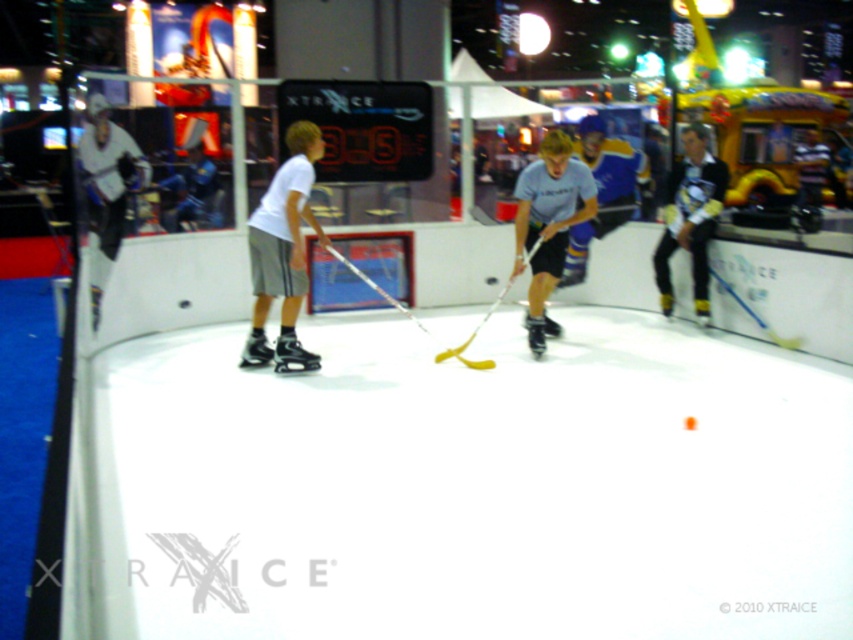
Is white matte shorts at center thinner than yellow plastic hockey stick at center?

Correct, white matte shorts at center's width is less than yellow plastic hockey stick at center's.

Does white matte shorts at center come behind yellow plastic hockey stick at center?

No, it is not.

Locate an element on the screen. Image resolution: width=853 pixels, height=640 pixels. white matte shorts at center is located at coordinates (283, 252).

Which is below, white matte shorts at center or light blue jersey at center?

white matte shorts at center is below.

Between white matte shorts at center and light blue jersey at center, which one is positioned higher?

Positioned higher is light blue jersey at center.

What do you see at coordinates (283, 252) in the screenshot? I see `white matte shorts at center` at bounding box center [283, 252].

The image size is (853, 640). In order to click on white matte shorts at center in this screenshot , I will do `click(283, 252)`.

Measure the distance between point (668, 252) and camera.

Point (668, 252) and camera are 6.70 meters apart from each other.

Is matte blue hockey stick at center positioned before yellow plastic hockey stick at center?

That is False.

Does point (663, 244) lie in front of point (412, 314)?

Yes, it is.

The image size is (853, 640). I want to click on matte blue hockey stick at center, so (x=753, y=314).